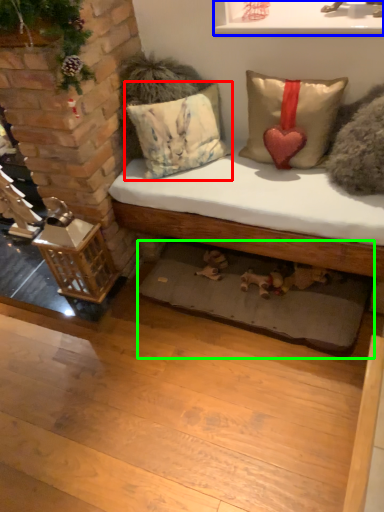
Question: Estimate the real-world distances between objects in this image. Which object is farther from pillow (highlighted by a red box), window sill (highlighted by a blue box) or mat (highlighted by a green box)?

Choices:
 (A) window sill
 (B) mat

Answer: (B)